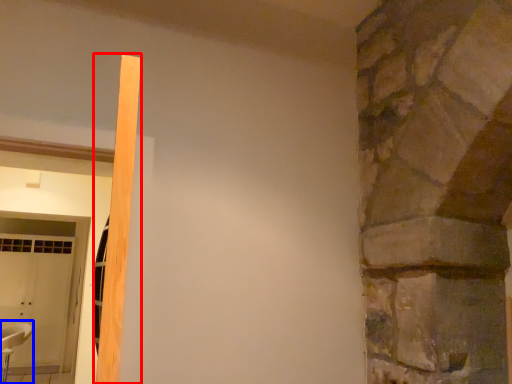
Question: Which object is closer to the camera taking this photo, beam (highlighted by a red box) or chair (highlighted by a blue box)?

Choices:
 (A) beam
 (B) chair

Answer: (A)